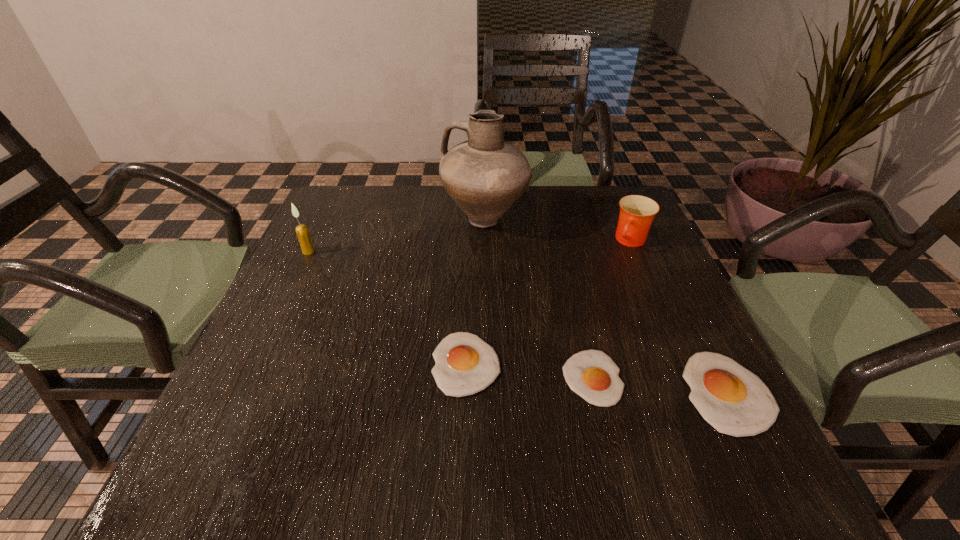
Identify the location of vacant area that lies between the rightmost egg yolk and the fourth object from left to right. (660, 385).

The image size is (960, 540). What are the coordinates of `object that is the nearest to the fifth tallest object` in the screenshot? It's located at (592, 374).

This screenshot has width=960, height=540. I want to click on the fifth closest object to the candle, so click(732, 399).

Locate an element on the screen. the second closest egg yolk to the second tallest egg yolk is located at coordinates pos(732,399).

I want to click on egg yolk identified as the closest to the rightmost egg yolk, so click(592, 374).

The height and width of the screenshot is (540, 960). In order to click on free point that satisfies the following two spatial constraints: 1. on the back side of the cup; 2. on the left side of the shortest egg yolk in this screenshot , I will do `click(561, 241)`.

Where is `vacant position in the image that satisfies the following two spatial constraints: 1. on the back side of the cup; 2. on the handle side of the pitcher`? Image resolution: width=960 pixels, height=540 pixels. vacant position in the image that satisfies the following two spatial constraints: 1. on the back side of the cup; 2. on the handle side of the pitcher is located at coordinates (622, 220).

I want to click on vacant space that satisfies the following two spatial constraints: 1. on the handle side of the pitcher; 2. on the back side of the fourth shortest object, so click(486, 241).

Find the location of `free spot that satisfies the following two spatial constraints: 1. on the handle side of the tallest object; 2. on the right side of the second egg yolk from right to left`. free spot that satisfies the following two spatial constraints: 1. on the handle side of the tallest object; 2. on the right side of the second egg yolk from right to left is located at coordinates (488, 378).

Where is `free space that satisfies the following two spatial constraints: 1. on the handle side of the pitcher; 2. on the left side of the rightmost egg yolk`? free space that satisfies the following two spatial constraints: 1. on the handle side of the pitcher; 2. on the left side of the rightmost egg yolk is located at coordinates (488, 393).